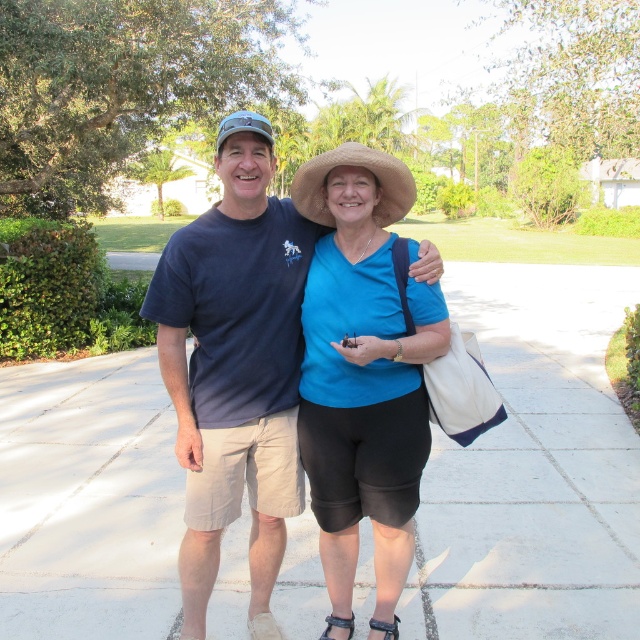
Based on the scene description, where is the white concrete pavement at center located in relation to the matte blue shirt at center?

The white concrete pavement at center is to the right of the matte blue shirt at center.

You are a delivery person trying to deliver a package to the address located on the white concrete pavement at center. The blue matte shirt at center is blocking your path. Can you go around them to reach the pavement?

The blue matte shirt at center is behind the white concrete pavement at center, so you can approach the white concrete pavement at center directly without needing to go around the blue matte shirt at center.

You are a photographer trying to capture a photo of the matte blue shirt at center and the straw hat at center. Your camera has a minimum focus distance of 1 meter. Can you focus on both objects simultaneously?

The matte blue shirt at center and straw hat at center are 97.89 centimeters apart. Since the distance between them is less than 1 meter, the camera might not be able to focus on both objects simultaneously as they are too close together.